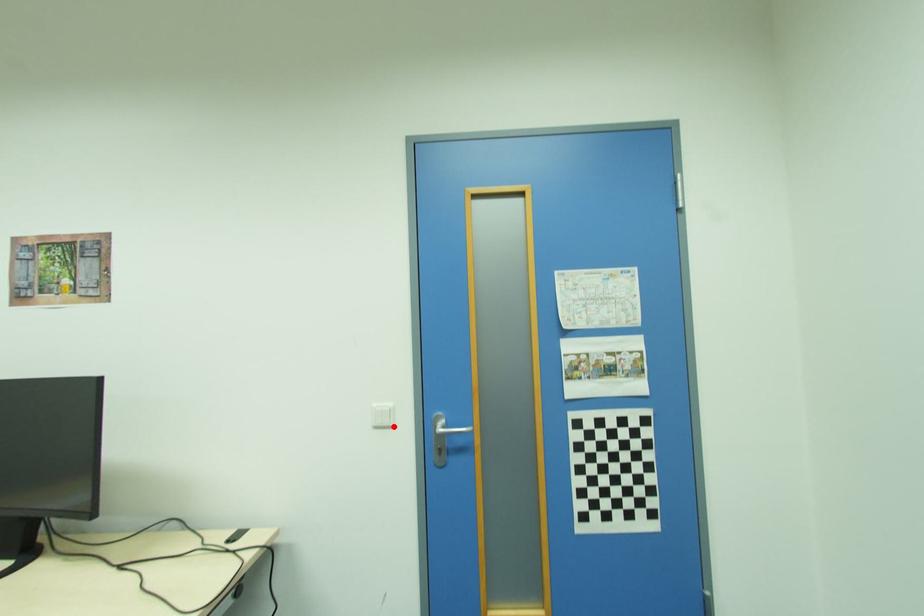
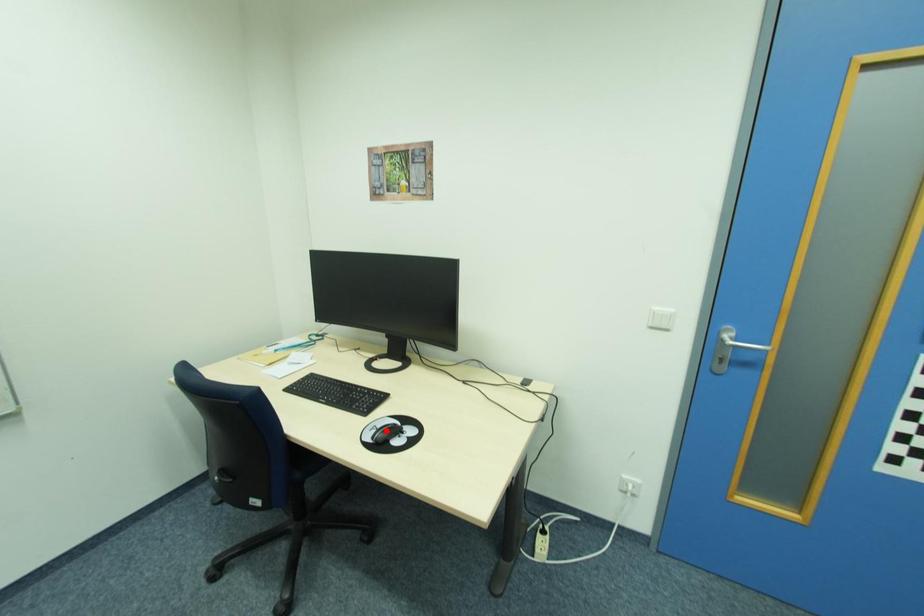
I am providing you with two images of the same scene from different viewpoints. A red point is marked on the first image and another point is marked on the second image. Is the red point in image1 aligned with the point shown in image2?

No